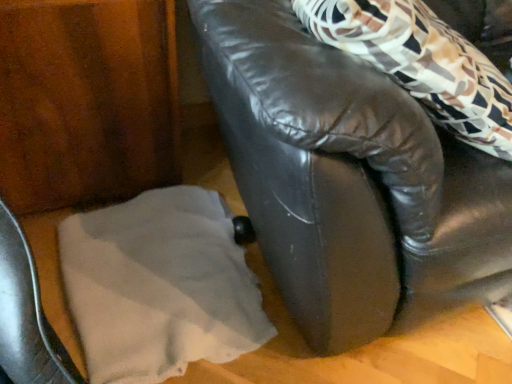
Question: Is white fabric at lower left smaller than black leather couch at center?

Choices:
 (A) yes
 (B) no

Answer: (A)

Question: From the image's perspective, would you say white fabric at lower left is shown under black leather couch at center?

Choices:
 (A) no
 (B) yes

Answer: (B)

Question: Does white fabric at lower left have a greater width compared to black leather couch at center?

Choices:
 (A) yes
 (B) no

Answer: (B)

Question: From a real-world perspective, is white fabric at lower left below black leather couch at center?

Choices:
 (A) yes
 (B) no

Answer: (A)

Question: Is there a large distance between white fabric at lower left and black leather couch at center?

Choices:
 (A) no
 (B) yes

Answer: (A)

Question: Can you confirm if white fabric at lower left is positioned to the right of black leather couch at center?

Choices:
 (A) no
 (B) yes

Answer: (A)

Question: Is black leather couch at center positioned far away from white fabric at lower left?

Choices:
 (A) yes
 (B) no

Answer: (B)

Question: Does black leather couch at center have a smaller size compared to white fabric at lower left?

Choices:
 (A) yes
 (B) no

Answer: (B)

Question: Is white fabric at lower left completely or partially inside black leather couch at center?

Choices:
 (A) yes
 (B) no

Answer: (B)

Question: Is black leather couch at center oriented towards white fabric at lower left?

Choices:
 (A) no
 (B) yes

Answer: (A)

Question: Is black leather couch at center to the right of white fabric at lower left from the viewer's perspective?

Choices:
 (A) yes
 (B) no

Answer: (A)

Question: Are black leather couch at center and white fabric at lower left beside each other?

Choices:
 (A) no
 (B) yes

Answer: (A)

Question: In terms of size, does white fabric at lower left appear bigger or smaller than black leather couch at center?

Choices:
 (A) small
 (B) big

Answer: (A)